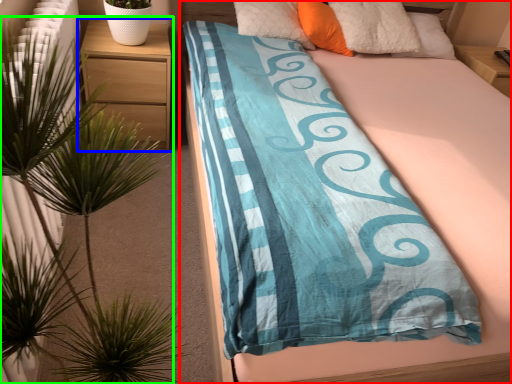
Question: Which object is the closest to the bed (highlighted by a red box)? Choose among these: nightstand (highlighted by a blue box) or houseplant (highlighted by a green box).

Choices:
 (A) nightstand
 (B) houseplant

Answer: (A)